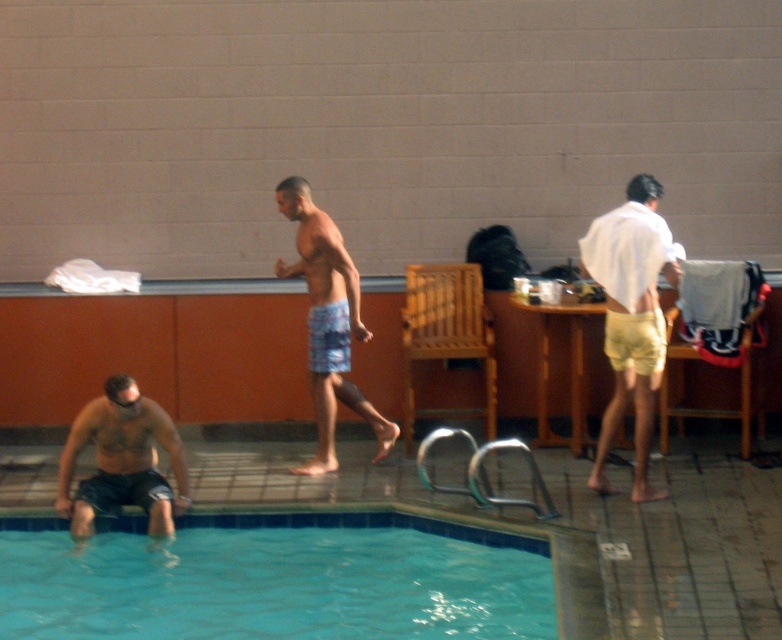
Between blue glossy water at lower left and matte black shorts at lower left, which one is positioned higher?

Positioned higher is matte black shorts at lower left.

Consider the image. Can you confirm if blue glossy water at lower left is bigger than matte black shorts at lower left?

Indeed, blue glossy water at lower left has a larger size compared to matte black shorts at lower left.

Find the location of `blue glossy water at lower left`. blue glossy water at lower left is located at coordinates (282, 577).

Who is positioned more to the right, blue glossy water at lower left or blue printed shorts at center?

blue printed shorts at center

The height and width of the screenshot is (640, 782). What do you see at coordinates (282, 577) in the screenshot?
I see `blue glossy water at lower left` at bounding box center [282, 577].

Is point (479, 541) more distant than point (318, 314)?

That is False.

I want to click on blue glossy water at lower left, so click(x=282, y=577).

Is point (357, 332) positioned before point (142, 410)?

No, it is behind (142, 410).

Does blue printed shorts at center appear under matte black shorts at lower left?

No.

Between point (318, 353) and point (79, 412), which one is positioned behind?

The point (79, 412) is behind.

Locate an element on the screen. blue printed shorts at center is located at coordinates (327, 323).